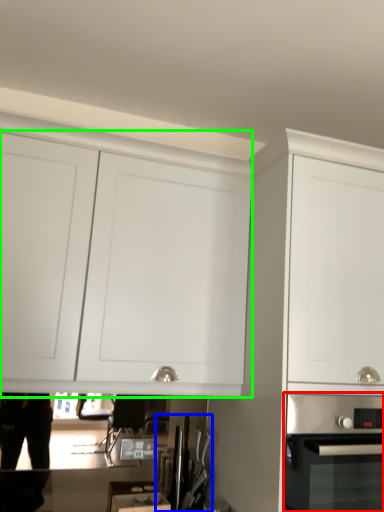
Question: Based on their relative distances, which object is farther from home appliance (highlighted by a red box)? Choose from kitchen appliance (highlighted by a blue box) and cabinetry (highlighted by a green box).

Choices:
 (A) kitchen appliance
 (B) cabinetry

Answer: (B)